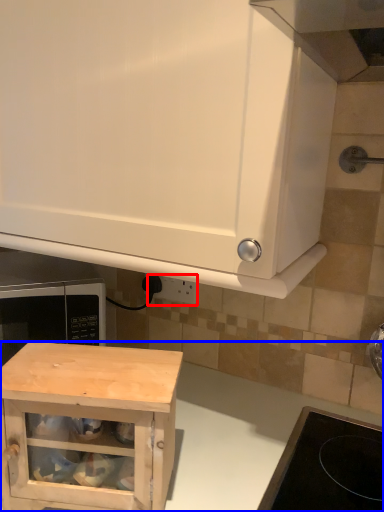
Question: Which point is further to the camera, electric outlet (highlighted by a red box) or counter (highlighted by a blue box)?

Choices:
 (A) electric outlet
 (B) counter

Answer: (A)